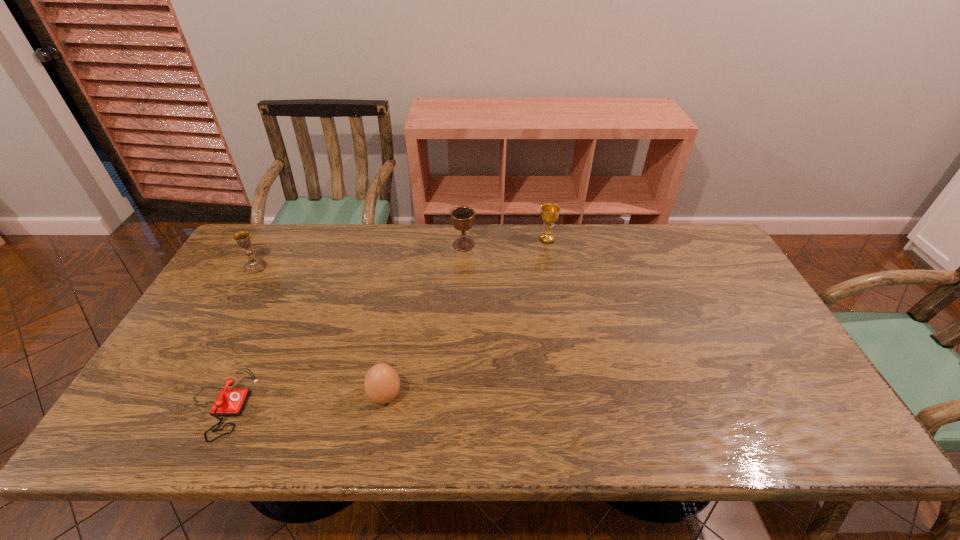
Find the location of a particular element. The width and height of the screenshot is (960, 540). the second chalice from right to left is located at coordinates (462, 217).

Find the location of a particular element. The image size is (960, 540). the rightmost object is located at coordinates (549, 212).

Image resolution: width=960 pixels, height=540 pixels. I want to click on the third nearest object, so click(253, 265).

Find the location of a particular element. The height and width of the screenshot is (540, 960). the nearest chalice is located at coordinates (253, 265).

Identify the location of the third object from left to right. (381, 383).

I want to click on telephone, so click(230, 401).

What are the coordinates of `the shortest object` in the screenshot? It's located at (230, 401).

I want to click on vacant space located on the left of the fourth object from left to right, so click(342, 245).

Where is `vacant space situated 0.080m on the front of the rightmost object`? Image resolution: width=960 pixels, height=540 pixels. vacant space situated 0.080m on the front of the rightmost object is located at coordinates (551, 260).

You are a GUI agent. You are given a task and a screenshot of the screen. Output one action in this format:
    pyautogui.click(x=<x>, y=<y>)
    Task: Click on the free space located on the right of the leftmost object
    The width and height of the screenshot is (960, 540).
    Given the screenshot: What is the action you would take?
    (351, 267)